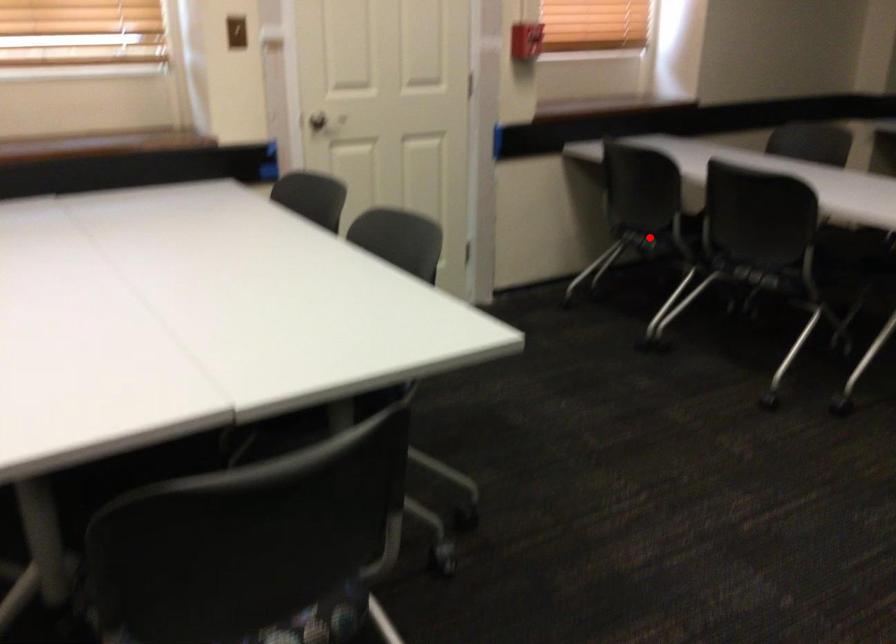
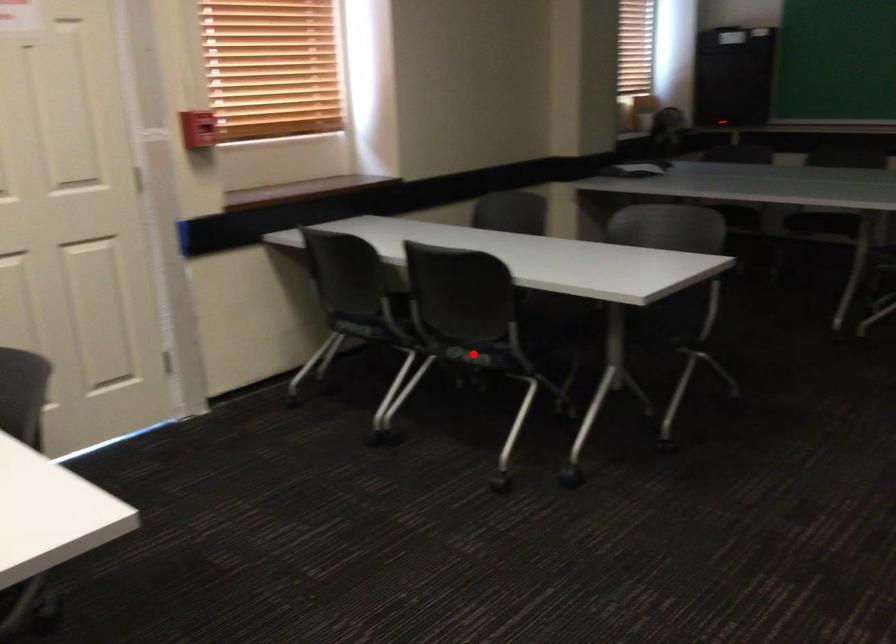
I am providing you with two images of the same scene from different viewpoints. A red point is marked on the first image and another point is marked on the second image. Are the points marked in image1 and image2 representing the same 3D position?

No